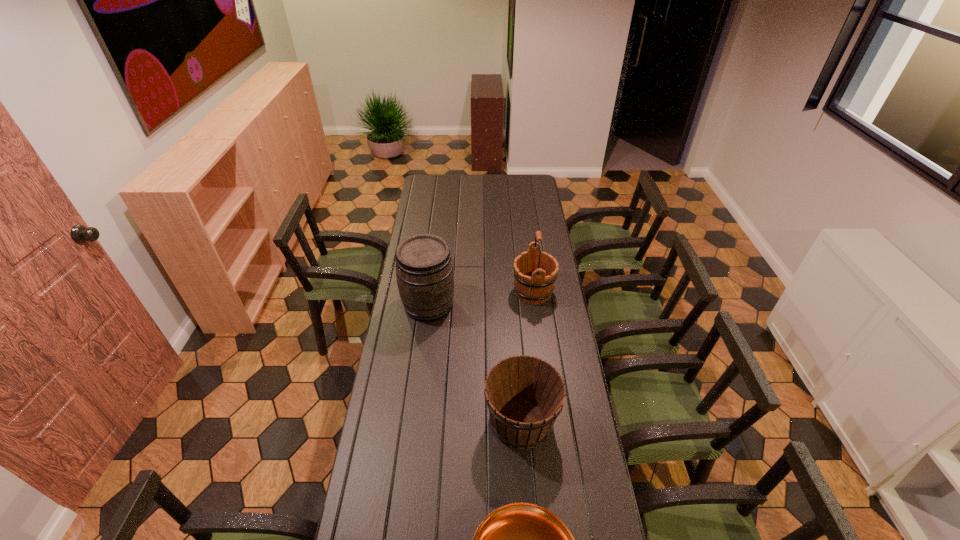
This screenshot has width=960, height=540. In order to click on the leftmost wine bucket in this screenshot , I will do `click(424, 269)`.

You are a GUI agent. You are given a task and a screenshot of the screen. Output one action in this format:
    pyautogui.click(x=<x>, y=<y>)
    Task: Click on the nearest wine bucket
    
    Given the screenshot: What is the action you would take?
    pyautogui.click(x=524, y=395)

Find the location of `the shortest wine bucket`. the shortest wine bucket is located at coordinates (524, 395).

The width and height of the screenshot is (960, 540). Identify the location of vacant area located on the right of the leftmost wine bucket. (531, 305).

What are the coordinates of `free location located on the back of the second nearest object` in the screenshot? It's located at (514, 316).

Identify the location of object located in the left edge section of the desktop. Image resolution: width=960 pixels, height=540 pixels. (424, 269).

Find the location of a particular element. The width and height of the screenshot is (960, 540). blank area at the far edge is located at coordinates (488, 178).

At what (x,y) coordinates should I click in order to perform the action: click on free space at the left edge. Please return your answer as a coordinate pair (x, y). Image resolution: width=960 pixels, height=540 pixels. Looking at the image, I should click on (369, 478).

Find the location of a particular element. Image resolution: width=960 pixels, height=540 pixels. blank area at the right edge is located at coordinates (529, 215).

Locate an element on the screen. The image size is (960, 540). free space at the far left corner is located at coordinates (445, 180).